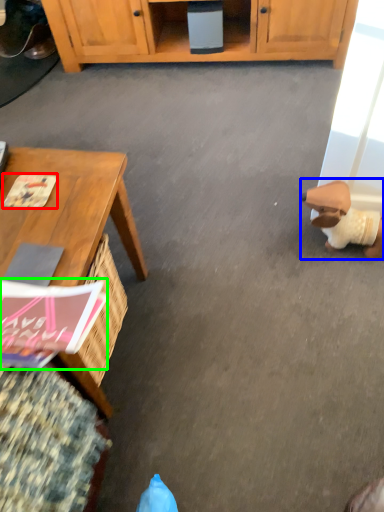
Question: Which object is the farthest from magazine (highlighted by a red box)? Choose among these: toy (highlighted by a blue box) or magazine (highlighted by a green box).

Choices:
 (A) toy
 (B) magazine

Answer: (A)